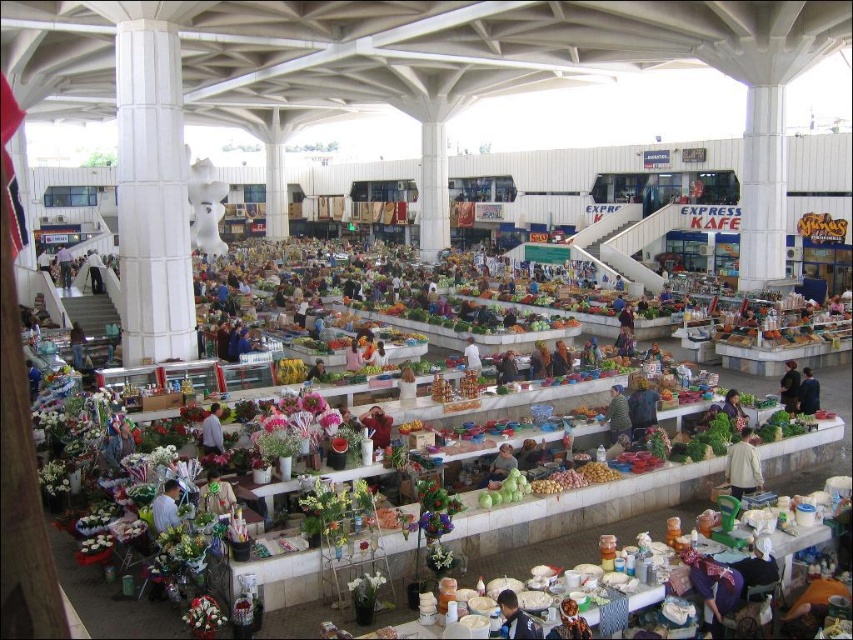
Question: Can you confirm if green fabric bag at center is thinner than blue fabric shirt at center?

Choices:
 (A) no
 (B) yes

Answer: (A)

Question: Observing the image, what is the correct spatial positioning of vibrant floral arrangements at center in reference to green fabric bag at center?

Choices:
 (A) below
 (B) above

Answer: (B)

Question: Does blue denim jacket at lower center have a larger size compared to dark blue jacket at lower right?

Choices:
 (A) yes
 (B) no

Answer: (B)

Question: Which point is closer to the camera taking this photo?

Choices:
 (A) (492, 536)
 (B) (735, 422)

Answer: (A)

Question: Based on their relative distances, which object is nearer to the yellow fabric shirt at lower right?

Choices:
 (A) smooth beige shirt at center
 (B) light blue shirt at center
 (C) white matte flower at lower left

Answer: (A)

Question: Which object appears closest to the camera in this image?

Choices:
 (A) white fabric at center
 (B) blue fabric headscarf at lower left
 (C) dark brown leather jacket at center

Answer: (B)